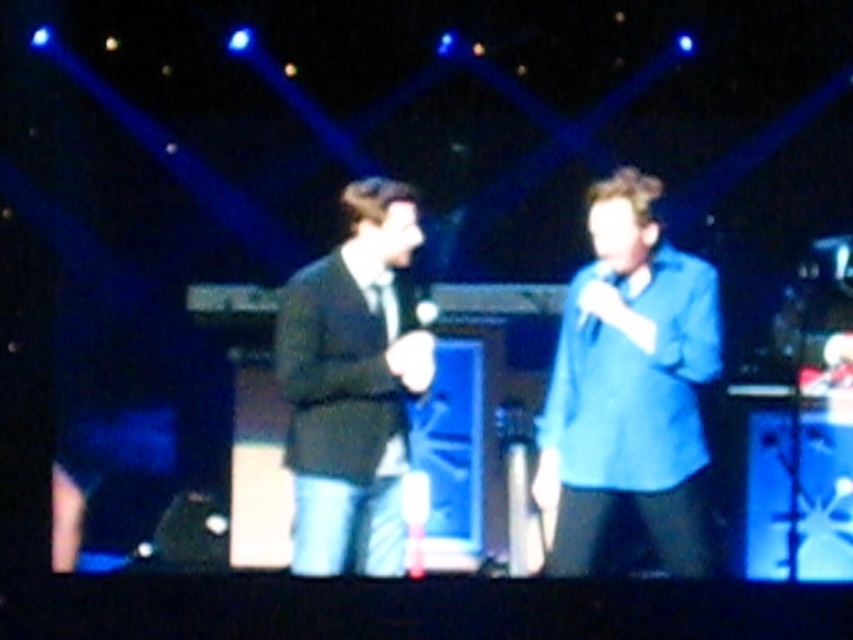
Question: In this image, where is matte black suit at center located relative to white matte microphone at center?

Choices:
 (A) above
 (B) below

Answer: (B)

Question: Which point is closer to the camera?

Choices:
 (A) blue matte shirt at center
 (B) matte black suit at center
 (C) white matte microphone at center

Answer: (A)

Question: Among these points, which one is nearest to the camera?

Choices:
 (A) (579, 326)
 (B) (283, 397)
 (C) (561, 454)

Answer: (A)

Question: Among these points, which one is farthest from the camera?

Choices:
 (A) (582, 324)
 (B) (392, 412)
 (C) (578, 573)

Answer: (C)

Question: Does blue matte shirt at center appear on the right side of matte black suit at center?

Choices:
 (A) no
 (B) yes

Answer: (B)

Question: Can you confirm if matte black suit at center is positioned to the left of white matte microphone at center?

Choices:
 (A) no
 (B) yes

Answer: (B)